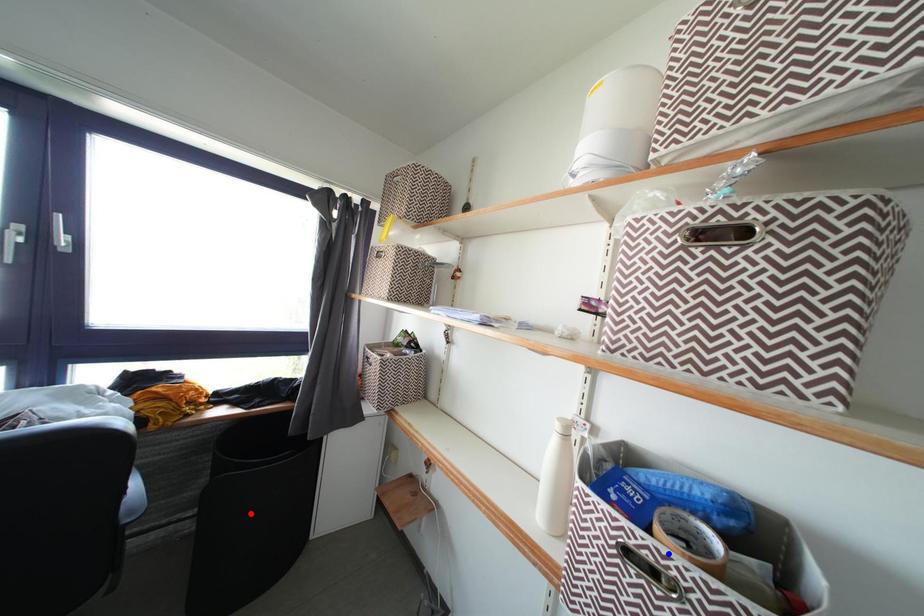
Question: In the image, two points are highlighted. Which point is nearer to the camera? Reply with the corresponding letter.

Choices:
 (A) blue point
 (B) red point

Answer: (A)